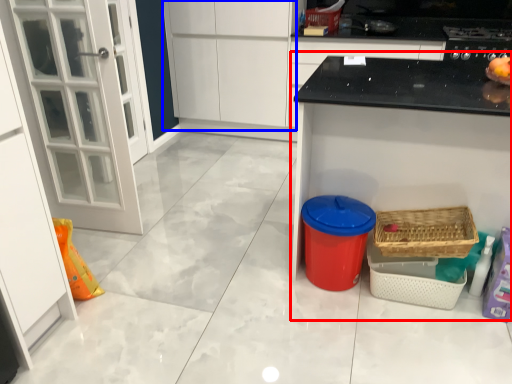
Question: Which object is closer to the camera taking this photo, counter (highlighted by a red box) or cabinetry (highlighted by a blue box)?

Choices:
 (A) counter
 (B) cabinetry

Answer: (A)